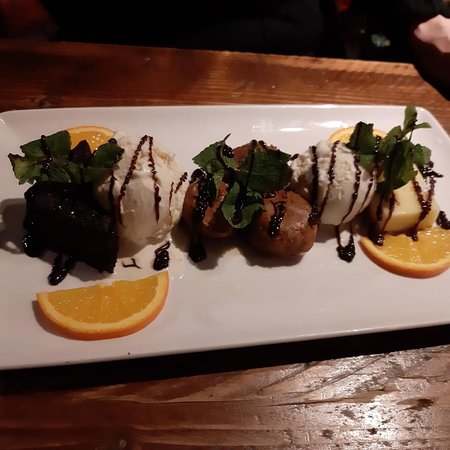
What are the coordinates of `plate` in the screenshot? It's located at (226, 301).